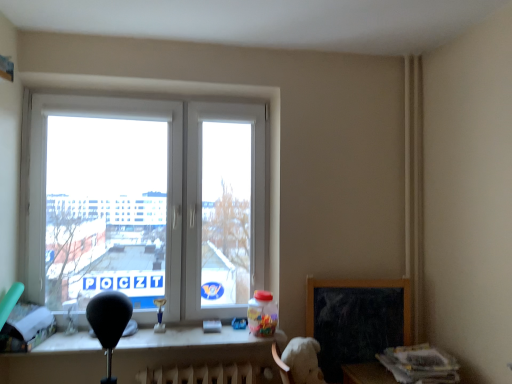
Question: Considering the relative sizes of white plastic table at lower center and black matte chalkboard at lower right in the image provided, is white plastic table at lower center bigger than black matte chalkboard at lower right?

Choices:
 (A) no
 (B) yes

Answer: (B)

Question: Considering the relative positions of white plastic table at lower center and black matte chalkboard at lower right in the image provided, is white plastic table at lower center in front of black matte chalkboard at lower right?

Choices:
 (A) no
 (B) yes

Answer: (B)

Question: Is white plastic table at lower center smaller than black matte chalkboard at lower right?

Choices:
 (A) no
 (B) yes

Answer: (A)

Question: Is white plastic table at lower center positioned beyond the bounds of black matte chalkboard at lower right?

Choices:
 (A) no
 (B) yes

Answer: (B)

Question: Is white plastic table at lower center at the left side of black matte chalkboard at lower right?

Choices:
 (A) yes
 (B) no

Answer: (A)

Question: In the image, is white plastic table at lower center on the left side or the right side of white plastic window at center?

Choices:
 (A) right
 (B) left

Answer: (A)

Question: Is white plastic table at lower center situated inside white plastic window at center or outside?

Choices:
 (A) inside
 (B) outside

Answer: (B)

Question: From the image's perspective, is white plastic table at lower center above or below white plastic window at center?

Choices:
 (A) below
 (B) above

Answer: (A)

Question: From their relative heights in the image, would you say white plastic table at lower center is taller or shorter than white plastic window at center?

Choices:
 (A) tall
 (B) short

Answer: (B)

Question: From the image's perspective, is white plastic window at center positioned above or below black matte chalkboard at lower right?

Choices:
 (A) below
 (B) above

Answer: (B)

Question: Is point (125, 274) positioned closer to the camera than point (309, 284)?

Choices:
 (A) farther
 (B) closer

Answer: (A)

Question: From a real-world perspective, is white plastic window at center positioned above or below black matte chalkboard at lower right?

Choices:
 (A) above
 (B) below

Answer: (A)

Question: Looking at their shapes, would you say white plastic window at center is wider or thinner than black matte chalkboard at lower right?

Choices:
 (A) thin
 (B) wide

Answer: (B)

Question: Is black matte chalkboard at lower right spatially inside white plastic window at center, or outside of it?

Choices:
 (A) outside
 (B) inside

Answer: (A)

Question: Considering the positions of black matte chalkboard at lower right and white plastic window at center in the image, is black matte chalkboard at lower right bigger or smaller than white plastic window at center?

Choices:
 (A) small
 (B) big

Answer: (A)